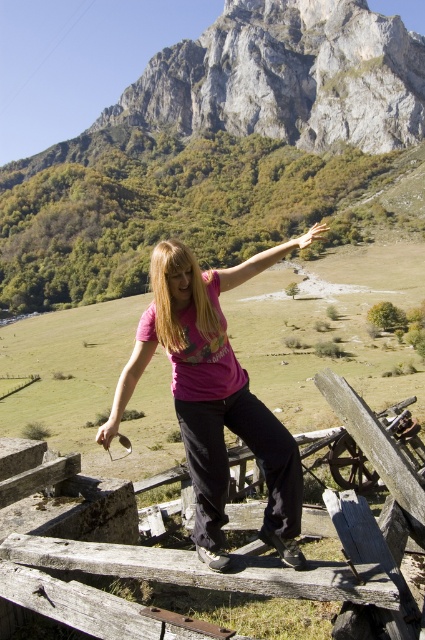
Question: Can you confirm if weathered wood fence at center is positioned above pink matte shirt at center?

Choices:
 (A) no
 (B) yes

Answer: (B)

Question: Does weathered wood fence at center appear on the left side of pink matte shirt at center?

Choices:
 (A) yes
 (B) no

Answer: (B)

Question: Which object is farther from the camera taking this photo?

Choices:
 (A) pink matte shirt at center
 (B) weathered wood fence at center

Answer: (A)

Question: Can you confirm if weathered wood fence at center is bigger than pink matte shirt at center?

Choices:
 (A) no
 (B) yes

Answer: (A)